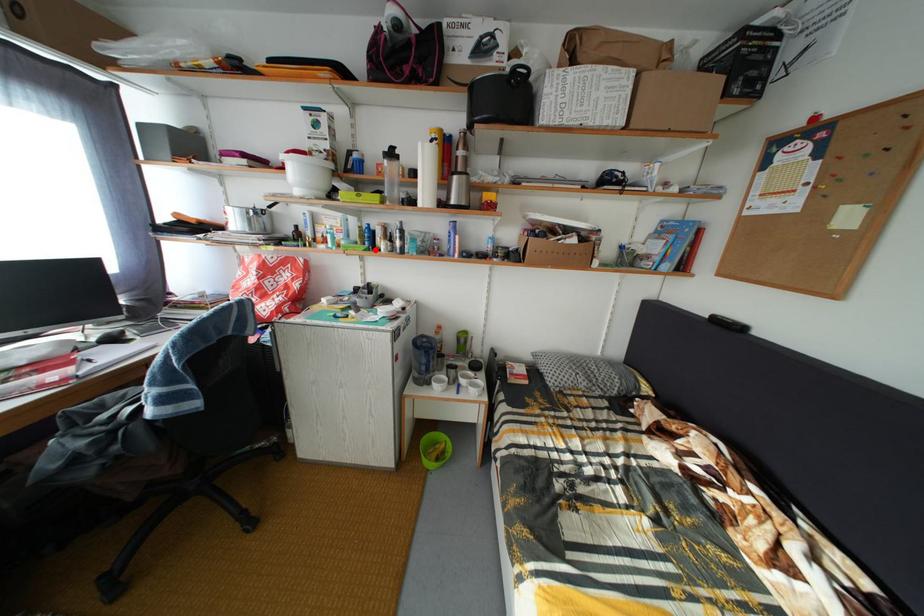
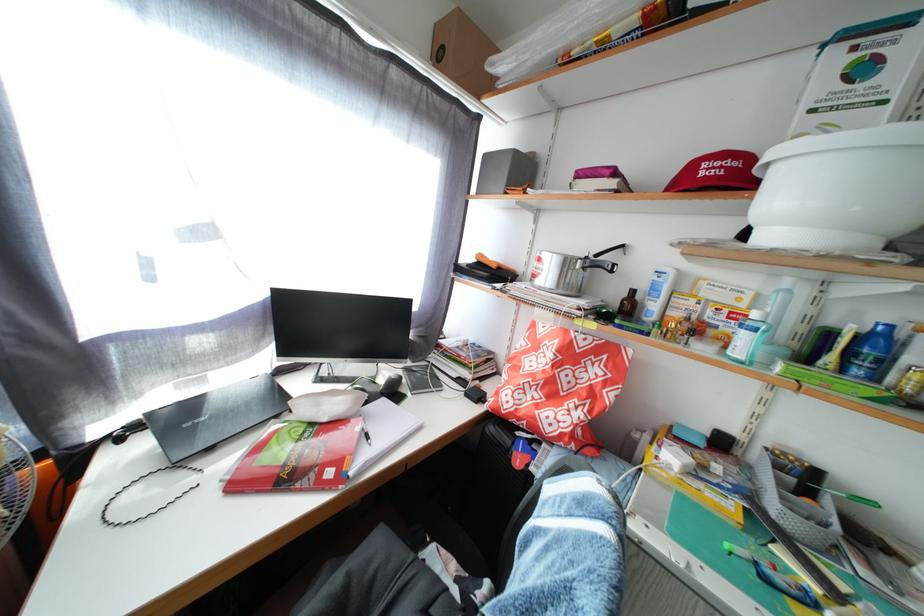
Find the pixel in the second image that matches the highlighted location in the first image.

(866, 378)